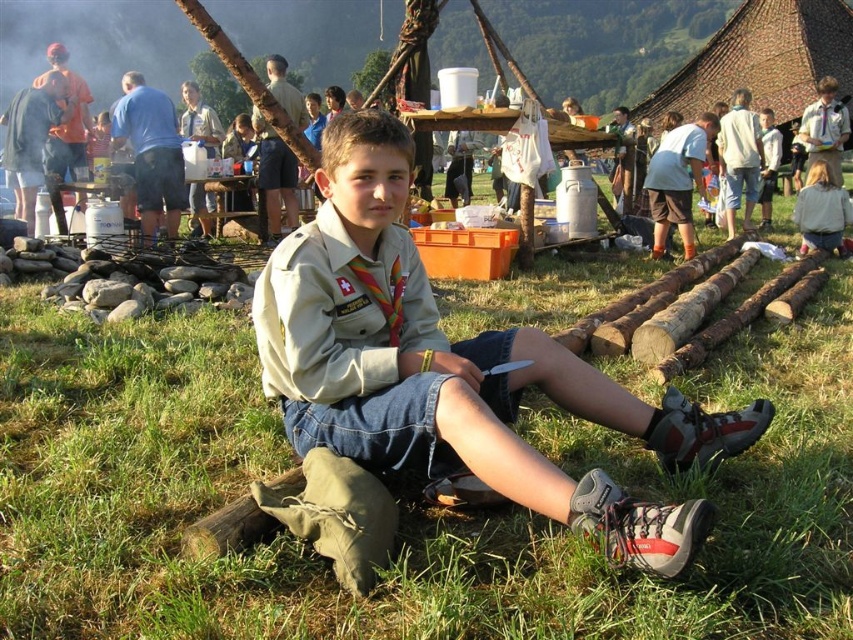
Question: Among these objects, which one is nearest to the camera?

Choices:
 (A) tan uniform at center
 (B) green grass at center

Answer: (A)

Question: Can you confirm if green grass at center is wider than tan uniform at center?

Choices:
 (A) yes
 (B) no

Answer: (B)

Question: Can you confirm if green grass at center is positioned below tan uniform at center?

Choices:
 (A) no
 (B) yes

Answer: (B)

Question: Can you confirm if green grass at center is thinner than light brown hair at upper right?

Choices:
 (A) no
 (B) yes

Answer: (B)

Question: Which of the following is the farthest from the observer?

Choices:
 (A) green grass at center
 (B) light brown hair at upper right
 (C) tan uniform at center

Answer: (B)

Question: Which point appears farthest from the camera in this image?

Choices:
 (A) (393, 232)
 (B) (824, 180)

Answer: (B)